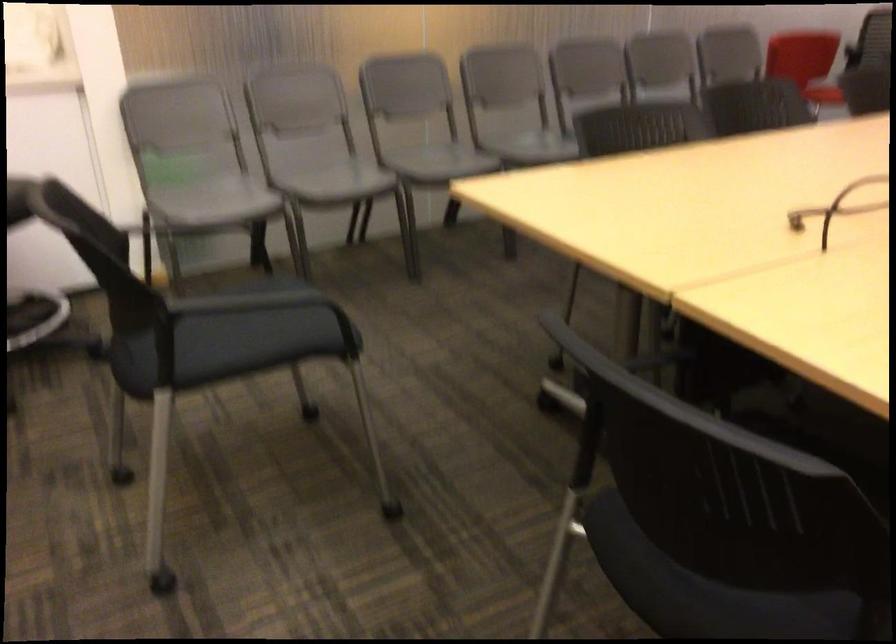
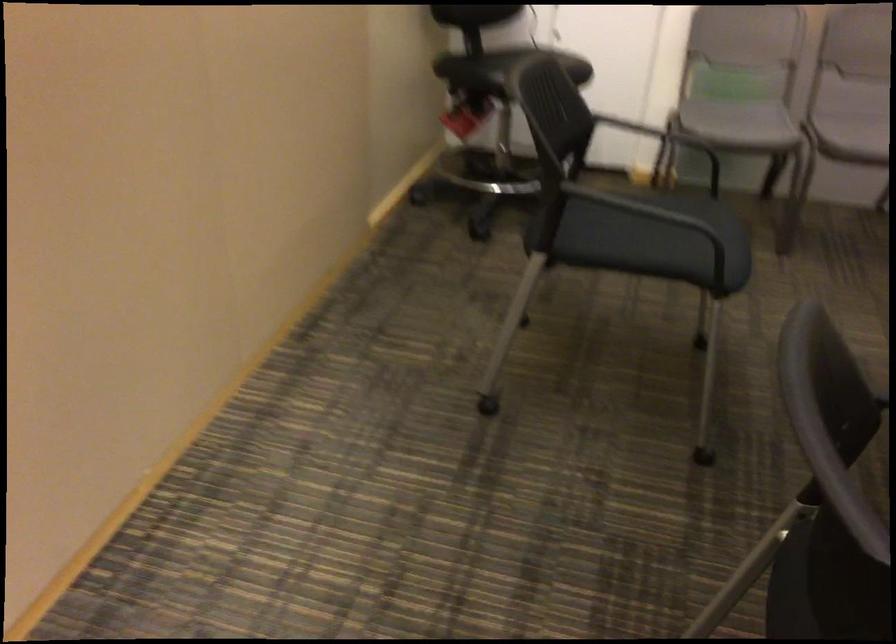
The point at (238,322) is marked in the first image. Where is the corresponding point in the second image?

(657, 222)